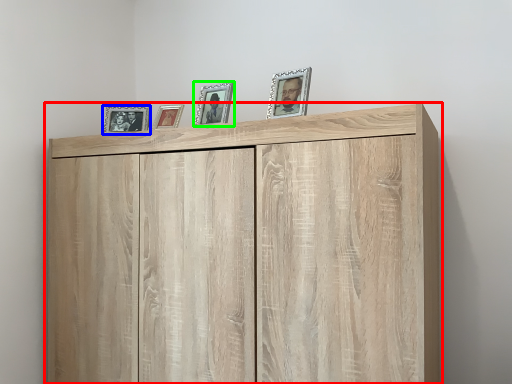
Question: Considering the real-world distances, which object is closest to cupboard (highlighted by a red box)? picture frame (highlighted by a blue box) or picture frame (highlighted by a green box).

Choices:
 (A) picture frame
 (B) picture frame

Answer: (B)